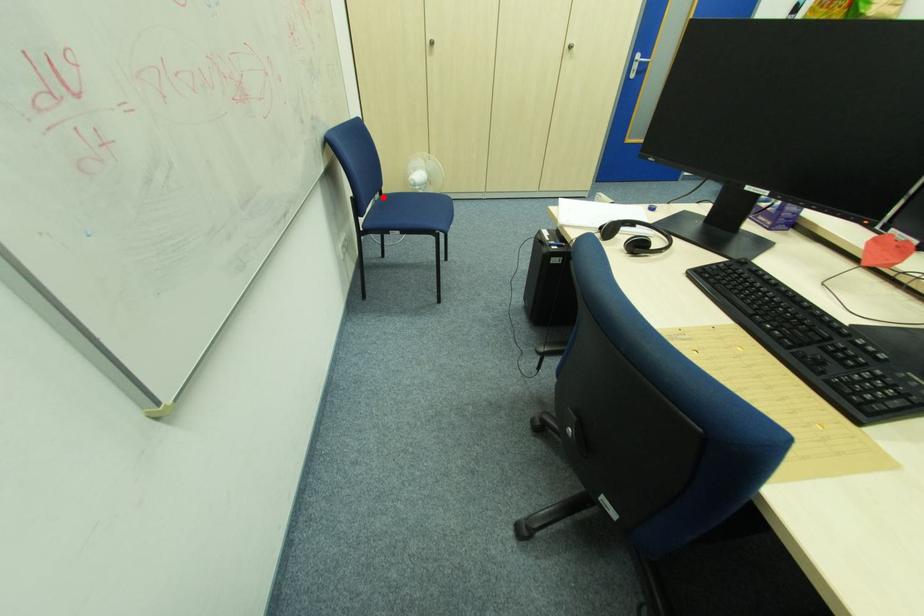
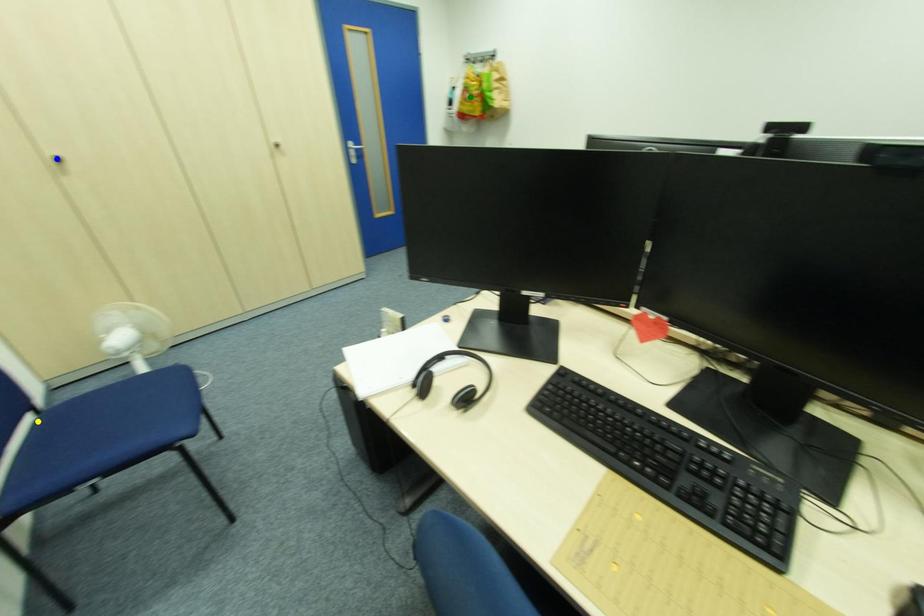
Question: I am providing you with two images of the same scene from different viewpoints. A red point is marked on the first image. You are given multiple points on the second image. In image 2, which mark is for the same physical point as the one in image 1?

Choices:
 (A) green point
 (B) yellow point
 (C) blue point

Answer: (B)